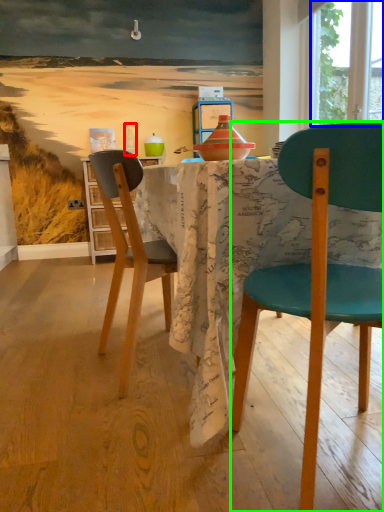
Question: Which object is the farthest from bottle (highlighted by a red box)? Choose among these: window screen (highlighted by a blue box) or chair (highlighted by a green box).

Choices:
 (A) window screen
 (B) chair

Answer: (B)